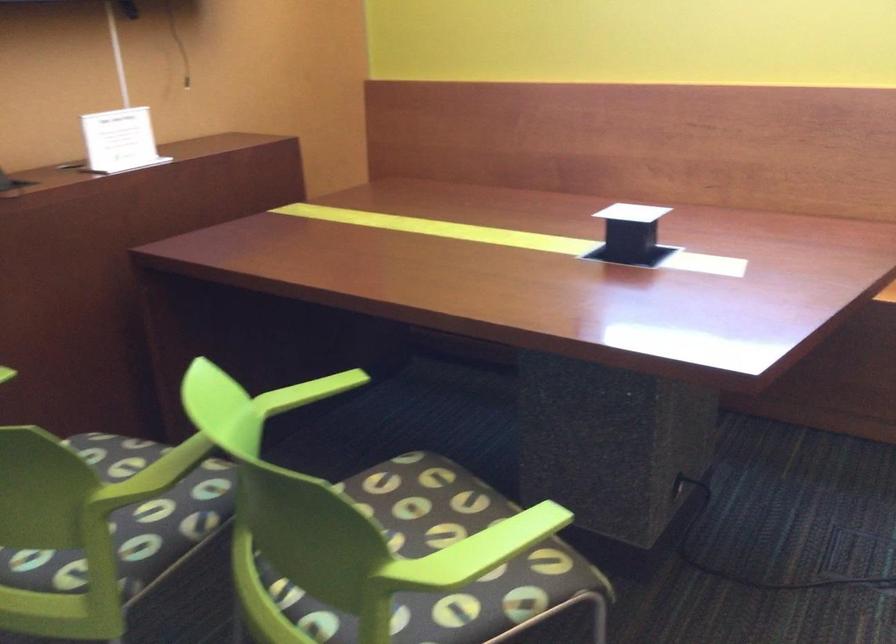
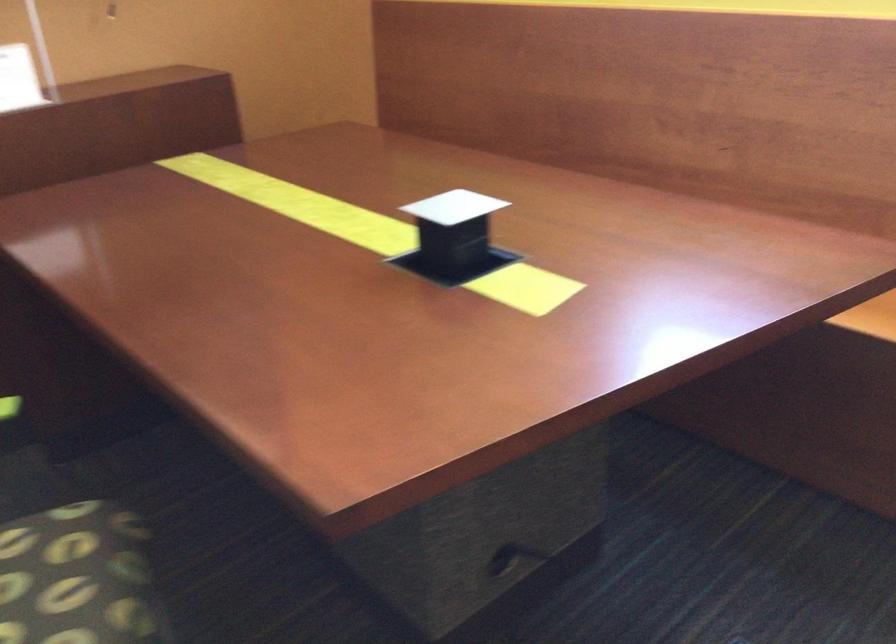
What movement of the cameraman would produce the second image?

The cameraman moved toward right, forward.